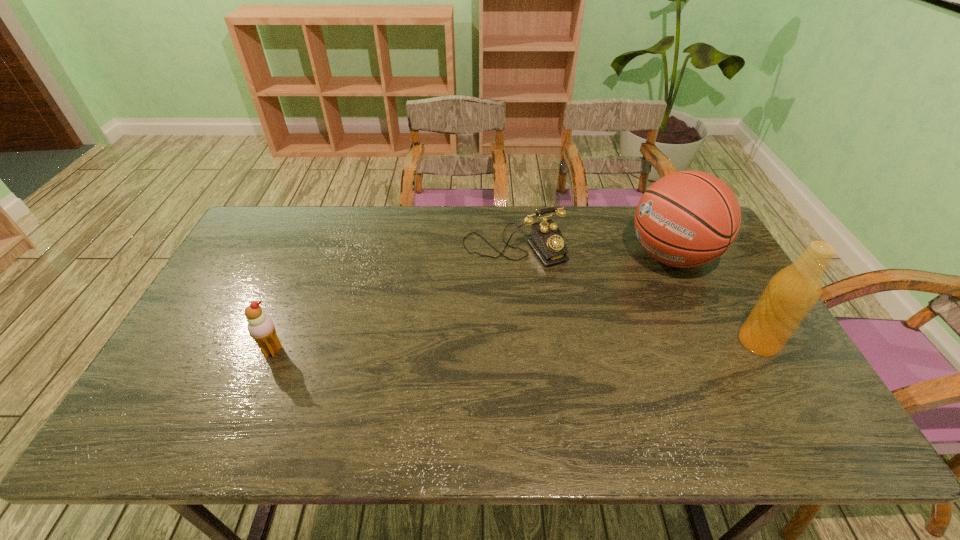
Where is `free area in between the leftmost object and the basketball`? The height and width of the screenshot is (540, 960). free area in between the leftmost object and the basketball is located at coordinates 472,303.

You are a GUI agent. You are given a task and a screenshot of the screen. Output one action in this format:
    pyautogui.click(x=<x>, y=<y>)
    Task: Click on the vacant space in between the leftmost object and the telephone
    The image size is (960, 540).
    Given the screenshot: What is the action you would take?
    pyautogui.click(x=394, y=298)

Find the location of a particular element. The width and height of the screenshot is (960, 540). vacant space that is in between the basketball and the leftmost object is located at coordinates (472, 303).

At what (x,y) coordinates should I click in order to perform the action: click on free space that is in between the beer bottle and the basketball. Please return your answer as a coordinate pair (x, y). The width and height of the screenshot is (960, 540). Looking at the image, I should click on (715, 299).

This screenshot has width=960, height=540. In order to click on vacant space that's between the beer bottle and the second shortest object in this screenshot , I will do `click(516, 346)`.

Identify which object is the second closest to the leftmost object. Please provide its 2D coordinates. Your answer should be formatted as a tuple, i.e. [(x, y)], where the tuple contains the x and y coordinates of a point satisfying the conditions above.

[(686, 219)]

Identify which object is the third closest to the basketball. Please provide its 2D coordinates. Your answer should be formatted as a tuple, i.e. [(x, y)], where the tuple contains the x and y coordinates of a point satisfying the conditions above.

[(260, 326)]

Locate an element on the screen. The height and width of the screenshot is (540, 960). vacant space that satisfies the following two spatial constraints: 1. on the front side of the third object from right to left; 2. on the right side of the basketball is located at coordinates (515, 256).